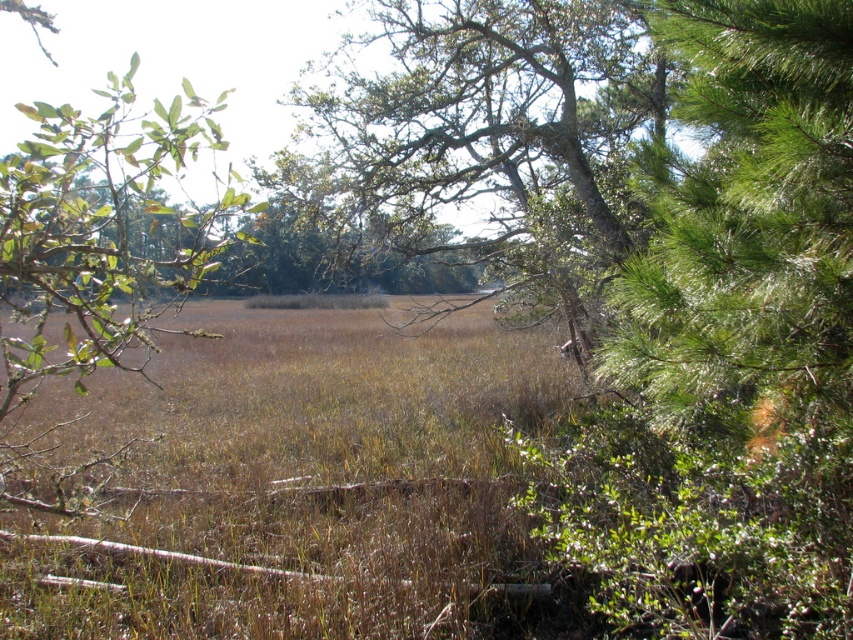
You are standing at the point marked as point (747, 227) in the image. Looking around, you notice green needle leaves to your right. What direction should you face to see the green needle leaves?

You should face to your right to see the green needle leaves at point (747, 227).